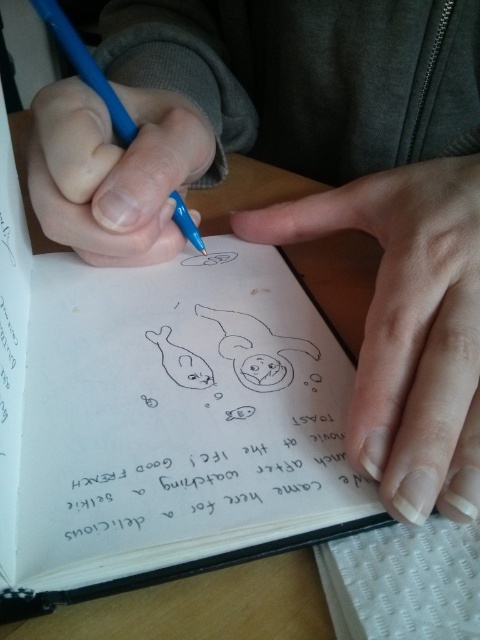
You are an artist trying to place a new sketch on the wooden surface. The white textured notepad at lower right is currently in the way. Can you move it to the left to make space?

The white textured notepad at lower right is located at point (404, 580), so moving it to the left would free up space on the wooden surface for your new sketch.

In the scene shown: Looking at the scene of someone writing in a notebook, where is the black paper text at center in relation to the blue plastic pen at upper left?

The black paper text at center is located to the right of the blue plastic pen at upper left.